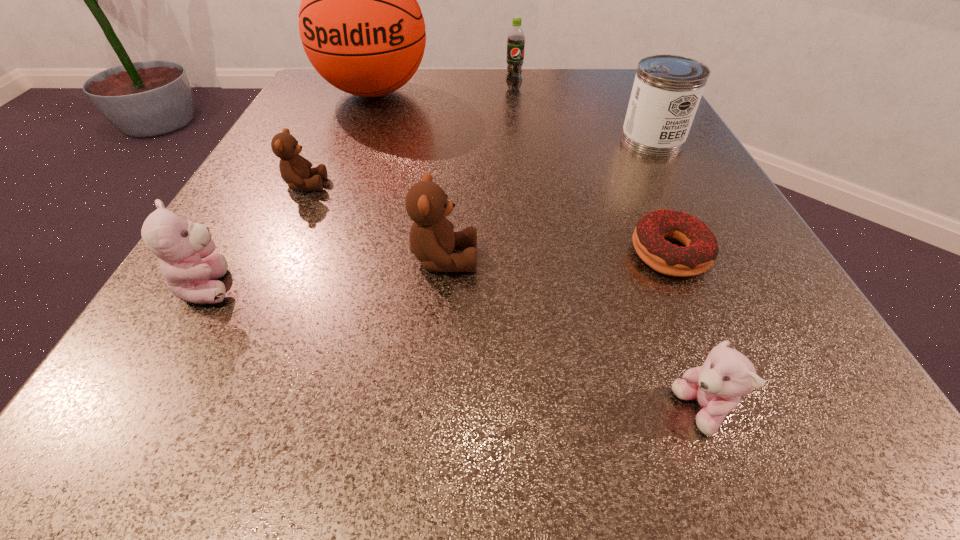
This screenshot has height=540, width=960. Identify the location of vacant region that satisfies the following two spatial constraints: 1. on the back side of the shortest object; 2. on the face of the farthest teddy bear. (640, 185).

Where is `vacant space that satisfies the following two spatial constraints: 1. on the front label of the green soda; 2. on the face of the left brown teddy bear`? The width and height of the screenshot is (960, 540). vacant space that satisfies the following two spatial constraints: 1. on the front label of the green soda; 2. on the face of the left brown teddy bear is located at coordinates (525, 185).

The width and height of the screenshot is (960, 540). In order to click on free space that satisfies the following two spatial constraints: 1. on the back side of the chocolate doughnut; 2. on the face of the farther brown teddy bear in this screenshot , I will do `click(640, 185)`.